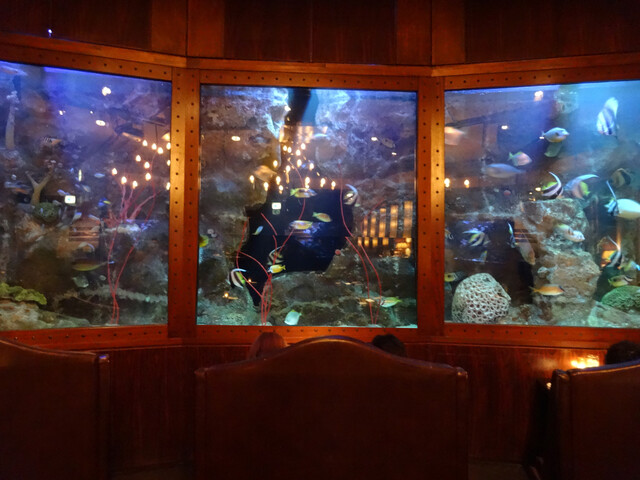
Identify the location of window 1. The image size is (640, 480). (90, 68).